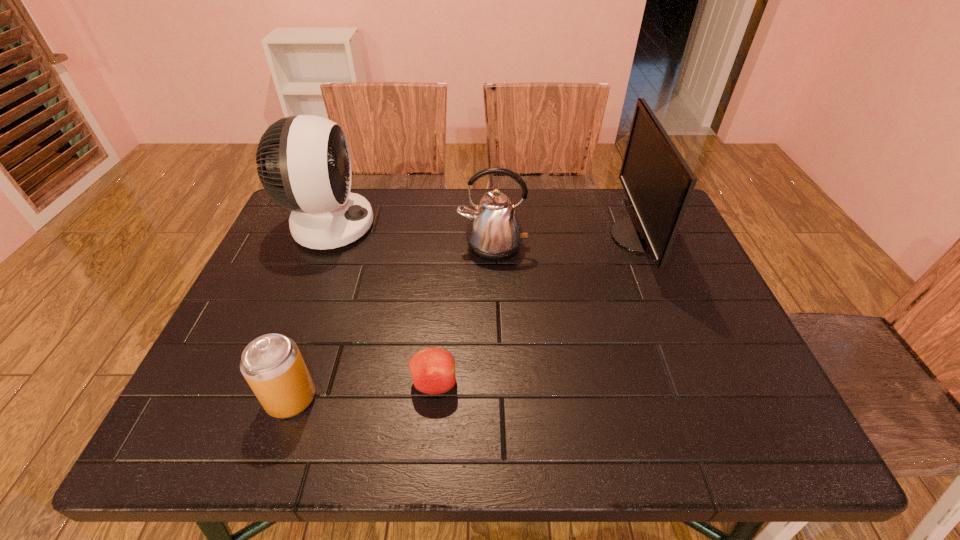
The image size is (960, 540). What are the coordinates of `free spot between the shortest object and the pop (soda)` in the screenshot? It's located at (362, 391).

Locate an element on the screen. vacant space in between the kettle and the second shortest object is located at coordinates (392, 322).

Find the location of a particular element. empty location between the rightmost object and the kettle is located at coordinates (565, 242).

You are a GUI agent. You are given a task and a screenshot of the screen. Output one action in this format:
    pyautogui.click(x=<x>, y=<y>)
    Task: Click on the free spot between the fan and the apple
    
    Given the screenshot: What is the action you would take?
    pyautogui.click(x=382, y=305)

This screenshot has height=540, width=960. Find the location of `empty location between the monitor and the second shortest object`. empty location between the monitor and the second shortest object is located at coordinates (465, 318).

Find the location of a particular element. This screenshot has width=960, height=540. blank region between the second shortest object and the third tallest object is located at coordinates (392, 322).

Find the location of a particular element. Image resolution: width=960 pixels, height=540 pixels. free space between the shortest object and the pop (soda) is located at coordinates (362, 391).

The height and width of the screenshot is (540, 960). Find the location of `object that can be found as the fourth closest to the kettle`. object that can be found as the fourth closest to the kettle is located at coordinates (272, 365).

Choose which object is the third nearest neighbor to the fan. Please provide its 2D coordinates. Your answer should be formatted as a tuple, i.e. [(x, y)], where the tuple contains the x and y coordinates of a point satisfying the conditions above.

[(432, 370)]

Locate an element on the screen. The height and width of the screenshot is (540, 960). vacant region that satisfies the following two spatial constraints: 1. on the grille of the pop (soda); 2. on the left side of the fan is located at coordinates (260, 398).